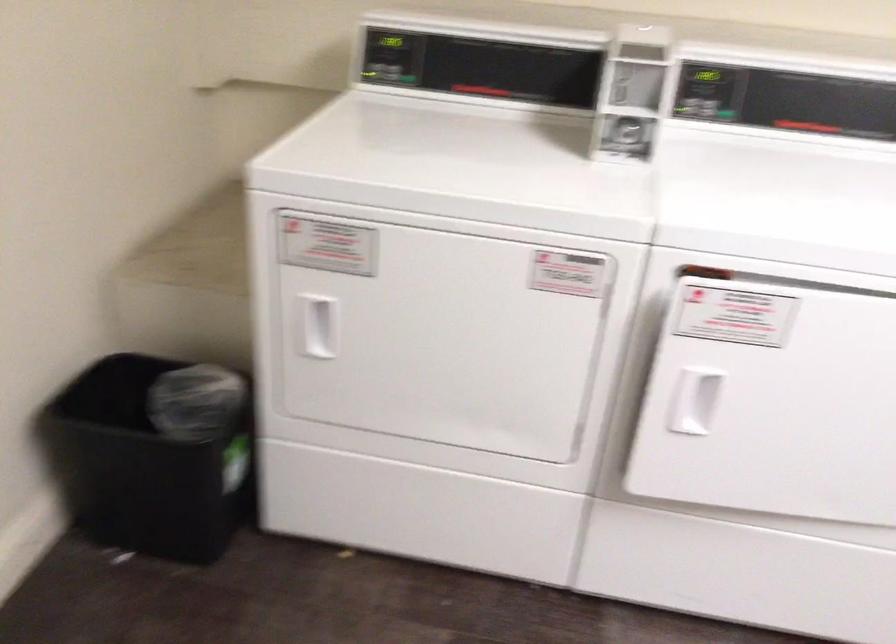
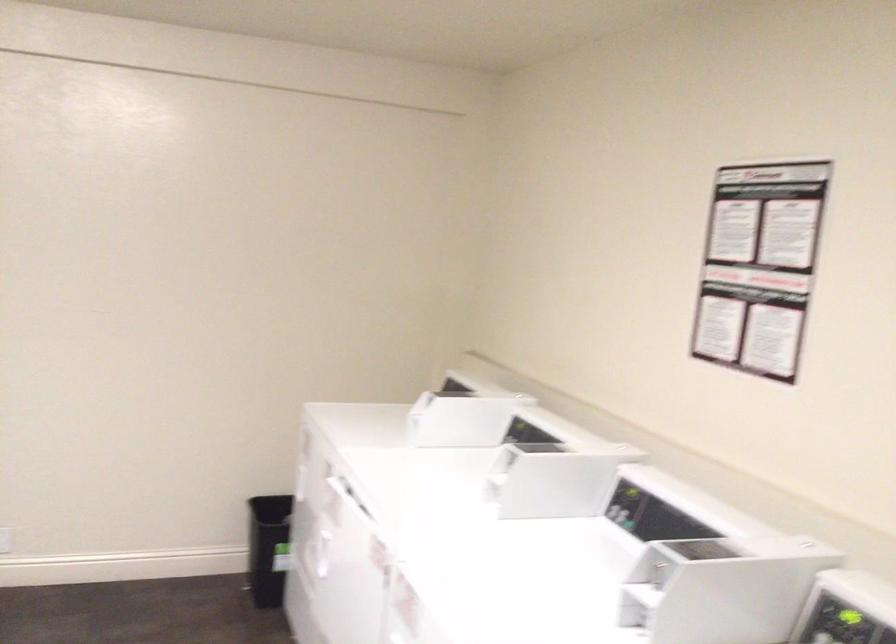
Locate, in the second image, the point that corresponds to point (765, 287) in the first image.

(348, 494)